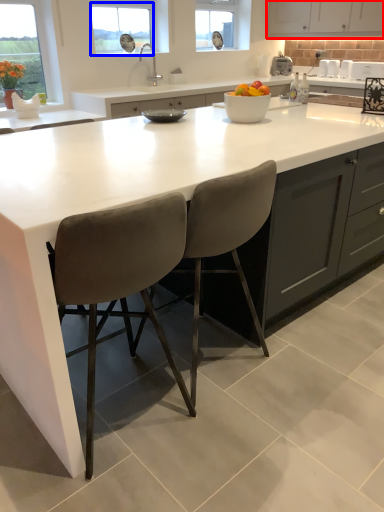
Question: Which of the following is the closest to the observer, cabinetry (highlighted by a red box) or window (highlighted by a blue box)?

Choices:
 (A) cabinetry
 (B) window

Answer: (B)